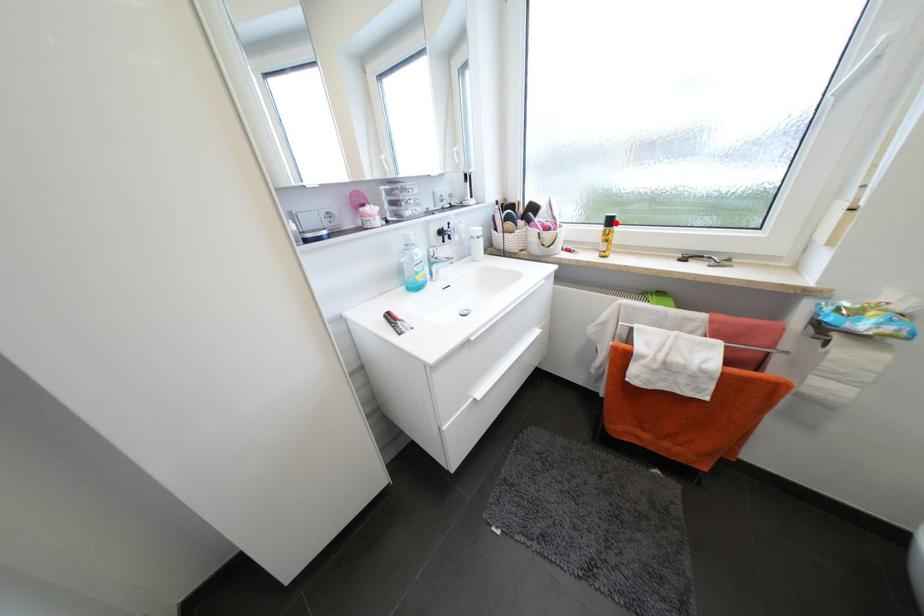
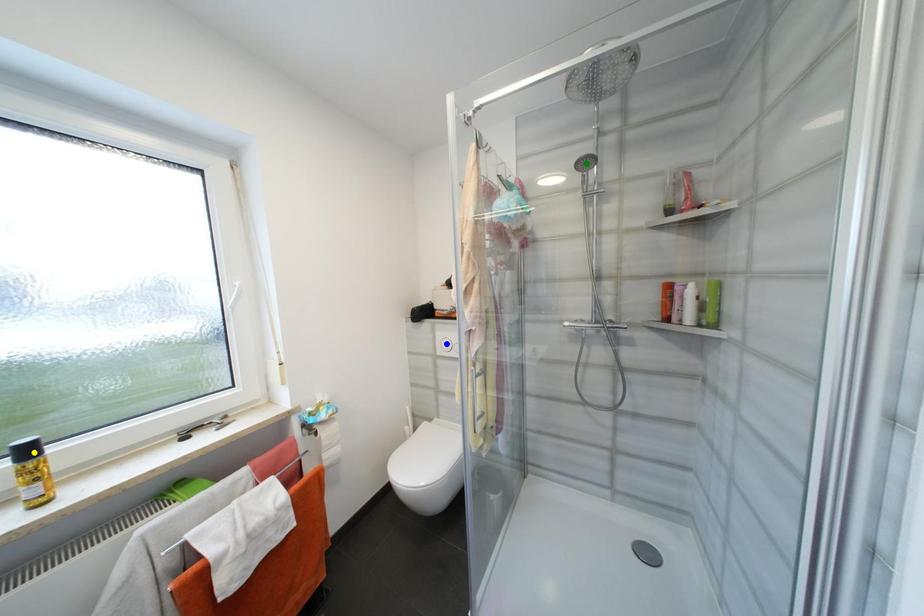
Question: I am providing you with two images of the same scene from different viewpoints. A red point is marked on the first image. You are given multiple points on the second image. In image 2, which mark is for the same physical point as the one in image 1?

Choices:
 (A) blue point
 (B) yellow point
 (C) green point

Answer: (B)